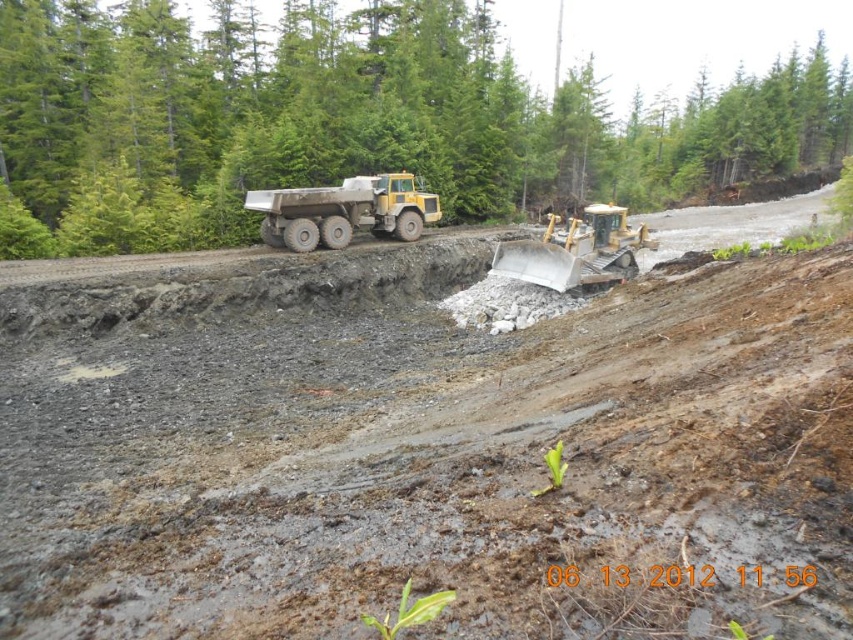
Question: Among these objects, which one is nearest to the camera?

Choices:
 (A) metallic yellow excavator at center
 (B) matte yellow truck at center
 (C) green leafy tree at upper center

Answer: (A)

Question: Among these objects, which one is nearest to the camera?

Choices:
 (A) matte yellow truck at center
 (B) green leafy tree at upper center
 (C) metallic yellow excavator at center

Answer: (C)

Question: Can you confirm if green leafy tree at upper center is positioned above matte yellow truck at center?

Choices:
 (A) no
 (B) yes

Answer: (B)

Question: Does green leafy tree at upper center come in front of metallic yellow excavator at center?

Choices:
 (A) no
 (B) yes

Answer: (A)

Question: Is matte yellow truck at center bigger than metallic yellow excavator at center?

Choices:
 (A) no
 (B) yes

Answer: (B)

Question: Which object is the closest to the green leafy tree at upper center?

Choices:
 (A) metallic yellow excavator at center
 (B) matte yellow truck at center

Answer: (B)